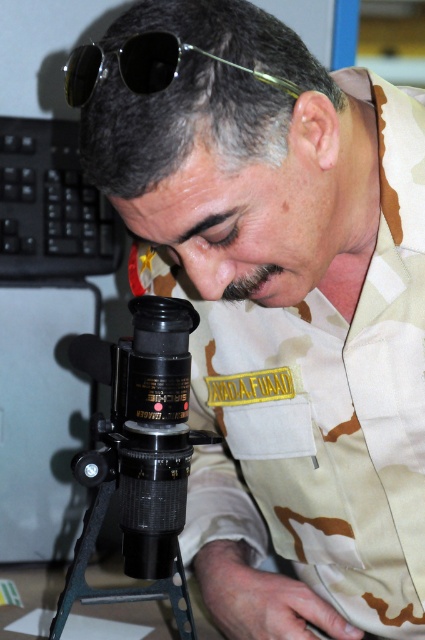
Who is higher up, black shiny sunglasses at upper center or black matte tripod at center?

black shiny sunglasses at upper center is higher up.

Who is more forward, (119,36) or (176,620)?

Point (119,36)

Identify the location of black shiny sunglasses at upper center. The height and width of the screenshot is (640, 425). (142, 65).

Can you confirm if black plastic camera at center is taller than black matte tripod at center?

Yes.

Is black plastic camera at center wider than black matte tripod at center?

Yes.

Which is behind, point (135, 502) or point (101, 500)?

The point (101, 500) is behind.

The height and width of the screenshot is (640, 425). I want to click on black plastic camera at center, so click(144, 428).

Is black plastic camera at center further to the viewer compared to black shiny sunglasses at upper center?

Yes.

Where is `black plastic camera at center`? Image resolution: width=425 pixels, height=640 pixels. black plastic camera at center is located at coordinates (144, 428).